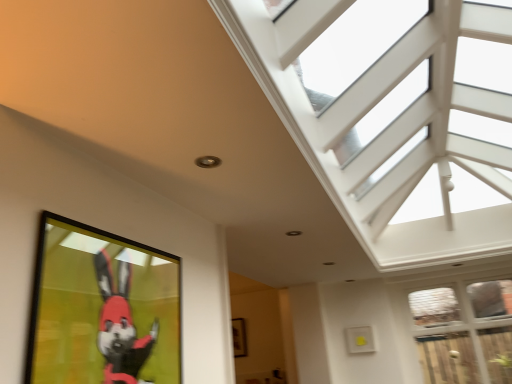
Describe the element at coordinates (102, 309) in the screenshot. This screenshot has width=512, height=384. I see `matte black picture frame at lower left, positioned as the 2th picture frame in bottom-to-top order` at that location.

The height and width of the screenshot is (384, 512). In order to click on wooden picture frame at center, marked as the second picture frame in a top-to-bottom arrangement in this screenshot , I will do `click(239, 337)`.

The image size is (512, 384). Identify the location of matte black picture frame at lower left, placed as the 2th picture frame when sorted from back to front. (102, 309).

Considering the sizes of objects matte black picture frame at lower left, placed as the 2th picture frame when sorted from back to front, and wooden picture frame at center, the 1th picture frame positioned from the back, in the image provided, who is bigger, matte black picture frame at lower left, placed as the 2th picture frame when sorted from back to front, or wooden picture frame at center, the 1th picture frame positioned from the back,?

Bigger between the two is matte black picture frame at lower left, placed as the 2th picture frame when sorted from back to front.

From their relative heights in the image, would you say matte black picture frame at lower left, the first picture frame from the top, is taller or shorter than wooden picture frame at center, arranged as the 1th picture frame when ordered from the bottom?

Considering their sizes, matte black picture frame at lower left, the first picture frame from the top, has less height than wooden picture frame at center, arranged as the 1th picture frame when ordered from the bottom.

Considering the positions of points (42, 242) and (236, 326), is point (42, 242) farther from camera compared to point (236, 326)?

No, it is in front of (236, 326).

Identify the location of picture frame below the wooden picture frame at center, the 1th picture frame positioned from the back (from a real-world perspective). (102, 309).

Is wooden picture frame at center, the 1th picture frame positioned from the back, at the back of clear glass door at lower right, positioned as the second window in top-to-bottom order?

clear glass door at lower right, positioned as the second window in top-to-bottom order, does not have its back to wooden picture frame at center, the 1th picture frame positioned from the back.

How different are the orientations of clear glass door at lower right, positioned as the second window in top-to-bottom order, and wooden picture frame at center, which is counted as the second picture frame, starting from the front, in degrees?

The angular difference between clear glass door at lower right, positioned as the second window in top-to-bottom order, and wooden picture frame at center, which is counted as the second picture frame, starting from the front, is 0.214 degrees.

From the image's perspective, is clear glass door at lower right, positioned as the second window in top-to-bottom order, positioned above or below wooden picture frame at center, arranged as the 1th picture frame when ordered from the bottom?

clear glass door at lower right, positioned as the second window in top-to-bottom order, is situated higher than wooden picture frame at center, arranged as the 1th picture frame when ordered from the bottom, in the image.

Is clear glass door at lower right, the first window in the bottom-to-top sequence, to the right of wooden picture frame at center, the 1th picture frame positioned from the back, from the viewer's perspective?

Indeed, clear glass door at lower right, the first window in the bottom-to-top sequence, is positioned on the right side of wooden picture frame at center, the 1th picture frame positioned from the back.

Is wooden picture frame at center, which is counted as the second picture frame, starting from the front, in front of matte black picture frame at lower left, placed as the 1th picture frame when sorted from front to back?

No, wooden picture frame at center, which is counted as the second picture frame, starting from the front, is further to the viewer.

From the image's perspective, would you say wooden picture frame at center, the 1th picture frame positioned from the back, is shown under matte black picture frame at lower left, the first picture frame from the top?

Yes.

Which of these two, wooden picture frame at center, the 1th picture frame positioned from the back, or matte black picture frame at lower left, placed as the 1th picture frame when sorted from front to back, is thinner?

matte black picture frame at lower left, placed as the 1th picture frame when sorted from front to back.

From a real-world perspective, is wooden picture frame at center, which is counted as the second picture frame, starting from the front, located beneath matte black picture frame at lower left, positioned as the 2th picture frame in bottom-to-top order?

Actually, wooden picture frame at center, which is counted as the second picture frame, starting from the front, is physically above matte black picture frame at lower left, positioned as the 2th picture frame in bottom-to-top order, in the real world.

Between wooden picture frame at center, the 1th picture frame positioned from the back, and clear glass door at lower right, positioned as the second window in top-to-bottom order, which one appears on the left side from the viewer's perspective?

wooden picture frame at center, the 1th picture frame positioned from the back, is more to the left.

Is there a large distance between wooden picture frame at center, the 1th picture frame positioned from the back, and clear glass door at lower right, positioned as the second window in top-to-bottom order?

Yes, wooden picture frame at center, the 1th picture frame positioned from the back, and clear glass door at lower right, positioned as the second window in top-to-bottom order, are quite far apart.

Based on the photo, how much distance is there between wooden picture frame at center, the 1th picture frame positioned from the back, and clear glass door at lower right, the first window in the bottom-to-top sequence?

A distance of 2.26 meters exists between wooden picture frame at center, the 1th picture frame positioned from the back, and clear glass door at lower right, the first window in the bottom-to-top sequence.

Is wooden picture frame at center, marked as the second picture frame in a top-to-bottom arrangement, taller or shorter than clear glass door at lower right, positioned as the second window in top-to-bottom order?

wooden picture frame at center, marked as the second picture frame in a top-to-bottom arrangement, is shorter than clear glass door at lower right, positioned as the second window in top-to-bottom order.

Is white textured glass at upper right, which ranks as the 1th window in top-to-bottom order, touching clear glass door at lower right, the first window in the bottom-to-top sequence?

white textured glass at upper right, which ranks as the 1th window in top-to-bottom order, and clear glass door at lower right, the first window in the bottom-to-top sequence, are clearly separated.

From the picture: From a real-world perspective, does white textured glass at upper right, the second window positioned from the bottom, sit lower than clear glass door at lower right, the first window in the bottom-to-top sequence?

No, from a real-world perspective, white textured glass at upper right, the second window positioned from the bottom, is not under clear glass door at lower right, the first window in the bottom-to-top sequence.

Does white textured glass at upper right, the second window positioned from the bottom, have a smaller size compared to clear glass door at lower right, positioned as the second window in top-to-bottom order?

Actually, white textured glass at upper right, the second window positioned from the bottom, might be larger than clear glass door at lower right, positioned as the second window in top-to-bottom order.

Does white textured glass at upper right, which ranks as the 1th window in top-to-bottom order, contain clear glass door at lower right, positioned as the second window in top-to-bottom order?

That's incorrect, clear glass door at lower right, positioned as the second window in top-to-bottom order, is not inside white textured glass at upper right, which ranks as the 1th window in top-to-bottom order.

Which is nearer, (240,328) or (255,29)?

Point (240,328).

Which is more to the right, wooden picture frame at center, arranged as the 1th picture frame when ordered from the bottom, or white textured glass at upper right, which ranks as the 1th window in top-to-bottom order?

white textured glass at upper right, which ranks as the 1th window in top-to-bottom order, is more to the right.

Is wooden picture frame at center, which is counted as the second picture frame, starting from the front, facing away from white textured glass at upper right, which ranks as the 1th window in top-to-bottom order?

wooden picture frame at center, which is counted as the second picture frame, starting from the front, does not have its back to white textured glass at upper right, which ranks as the 1th window in top-to-bottom order.

The height and width of the screenshot is (384, 512). Find the location of `the 1st picture frame located beneath the white textured glass at upper right, which ranks as the 1th window in top-to-bottom order (from a real-world perspective)`. the 1st picture frame located beneath the white textured glass at upper right, which ranks as the 1th window in top-to-bottom order (from a real-world perspective) is located at coordinates (239, 337).

Where is `picture frame above the clear glass door at lower right, the first window in the bottom-to-top sequence (from the image's perspective)`? This screenshot has width=512, height=384. picture frame above the clear glass door at lower right, the first window in the bottom-to-top sequence (from the image's perspective) is located at coordinates (102, 309).

How much distance is there between clear glass door at lower right, positioned as the second window in top-to-bottom order, and matte black picture frame at lower left, placed as the 1th picture frame when sorted from front to back?

clear glass door at lower right, positioned as the second window in top-to-bottom order, is 3.74 meters away from matte black picture frame at lower left, placed as the 1th picture frame when sorted from front to back.

Can you confirm if clear glass door at lower right, positioned as the second window in top-to-bottom order, is positioned to the left of matte black picture frame at lower left, placed as the 1th picture frame when sorted from front to back?

In fact, clear glass door at lower right, positioned as the second window in top-to-bottom order, is to the right of matte black picture frame at lower left, placed as the 1th picture frame when sorted from front to back.

Consider the image. Is clear glass door at lower right, positioned as the second window in top-to-bottom order, positioned behind matte black picture frame at lower left, placed as the 1th picture frame when sorted from front to back?

Yes, clear glass door at lower right, positioned as the second window in top-to-bottom order, is further from the viewer.

Locate an element on the screen. This screenshot has width=512, height=384. picture frame lying behind the matte black picture frame at lower left, positioned as the 2th picture frame in bottom-to-top order is located at coordinates (239, 337).

Starting from the clear glass door at lower right, the first window in the bottom-to-top sequence, which picture frame is the 1st one to the left? Please provide its 2D coordinates.

[(239, 337)]

From the image, which object appears to be farther from matte black picture frame at lower left, placed as the 2th picture frame when sorted from back to front, wooden picture frame at center, the 1th picture frame positioned from the back, or clear glass door at lower right, positioned as the second window in top-to-bottom order?

clear glass door at lower right, positioned as the second window in top-to-bottom order.

Which object lies nearer to the anchor point white textured glass at upper right, which ranks as the 1th window in top-to-bottom order, wooden picture frame at center, which is counted as the second picture frame, starting from the front, or clear glass door at lower right, the first window in the bottom-to-top sequence?

The object closer to white textured glass at upper right, which ranks as the 1th window in top-to-bottom order, is clear glass door at lower right, the first window in the bottom-to-top sequence.

Based on their spatial positions, is matte black picture frame at lower left, positioned as the 2th picture frame in bottom-to-top order, or white textured glass at upper right, which ranks as the 1th window in top-to-bottom order, closer to clear glass door at lower right, positioned as the second window in top-to-bottom order?

white textured glass at upper right, which ranks as the 1th window in top-to-bottom order.

Based on their spatial positions, is wooden picture frame at center, which is counted as the second picture frame, starting from the front, or matte black picture frame at lower left, the first picture frame from the top, further from white textured glass at upper right, which ranks as the 1th window in top-to-bottom order?

wooden picture frame at center, which is counted as the second picture frame, starting from the front.

Based on the photo, when comparing their distances from clear glass door at lower right, positioned as the second window in top-to-bottom order, does white textured glass at upper right, the second window positioned from the bottom, or matte black picture frame at lower left, placed as the 1th picture frame when sorted from front to back, seem closer?

white textured glass at upper right, the second window positioned from the bottom, is positioned closer to the anchor clear glass door at lower right, positioned as the second window in top-to-bottom order.

Which object lies nearer to the anchor point wooden picture frame at center, arranged as the 1th picture frame when ordered from the bottom, clear glass door at lower right, the first window in the bottom-to-top sequence, or matte black picture frame at lower left, placed as the 2th picture frame when sorted from back to front?

Based on the image, clear glass door at lower right, the first window in the bottom-to-top sequence, appears to be nearer to wooden picture frame at center, arranged as the 1th picture frame when ordered from the bottom.

Based on their spatial positions, is clear glass door at lower right, positioned as the second window in top-to-bottom order, or wooden picture frame at center, the 1th picture frame positioned from the back, closer to matte black picture frame at lower left, positioned as the 2th picture frame in bottom-to-top order?

wooden picture frame at center, the 1th picture frame positioned from the back, is positioned closer to the anchor matte black picture frame at lower left, positioned as the 2th picture frame in bottom-to-top order.

When comparing their distances from white textured glass at upper right, which ranks as the 1th window in top-to-bottom order, does clear glass door at lower right, the first window in the bottom-to-top sequence, or wooden picture frame at center, which is counted as the second picture frame, starting from the front, seem further?

wooden picture frame at center, which is counted as the second picture frame, starting from the front, is positioned further to the anchor white textured glass at upper right, which ranks as the 1th window in top-to-bottom order.

Locate an element on the screen. The image size is (512, 384). picture frame located between white textured glass at upper right, the second window positioned from the bottom, and clear glass door at lower right, positioned as the second window in top-to-bottom order, in the depth direction is located at coordinates (102, 309).

At what (x,y) coordinates should I click in order to perform the action: click on window located between white textured glass at upper right, which ranks as the 1th window in top-to-bottom order, and wooden picture frame at center, which is counted as the second picture frame, starting from the front, in the depth direction. Please return your answer as a coordinate pair (x, y). The height and width of the screenshot is (384, 512). Looking at the image, I should click on (464, 331).

Where is `picture frame between white textured glass at upper right, which ranks as the 1th window in top-to-bottom order, and wooden picture frame at center, the 1th picture frame positioned from the back, along the z-axis`? The width and height of the screenshot is (512, 384). picture frame between white textured glass at upper right, which ranks as the 1th window in top-to-bottom order, and wooden picture frame at center, the 1th picture frame positioned from the back, along the z-axis is located at coordinates (102, 309).

I want to click on window located between matte black picture frame at lower left, placed as the 1th picture frame when sorted from front to back, and wooden picture frame at center, which is counted as the second picture frame, starting from the front, in the depth direction, so click(x=464, y=331).